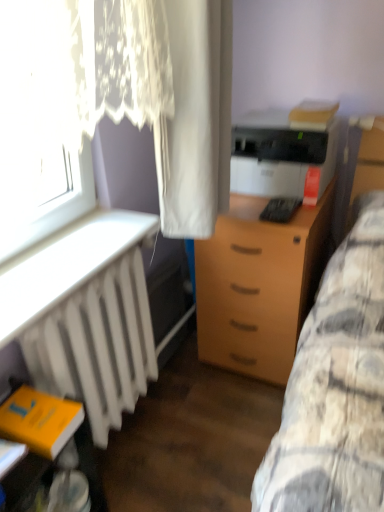
Question: Should I look upward or downward to see light brown wood drawer at center?

Choices:
 (A) down
 (B) up

Answer: (A)

Question: Is yellow matte book at lower left shorter than white sheer curtain at upper left, positioned as the second curtain in right-to-left order?

Choices:
 (A) yes
 (B) no

Answer: (A)

Question: Is yellow matte book at lower left not within white sheer curtain at upper left, positioned as the second curtain in right-to-left order?

Choices:
 (A) yes
 (B) no

Answer: (A)

Question: Is white sheer curtain at upper left, which appears as the 1th curtain when viewed from the left, at the back of yellow matte book at lower left?

Choices:
 (A) yes
 (B) no

Answer: (B)

Question: Considering the relative positions of yellow matte book at lower left and white sheer curtain at upper left, which appears as the 1th curtain when viewed from the left, in the image provided, is yellow matte book at lower left in front of white sheer curtain at upper left, which appears as the 1th curtain when viewed from the left,?

Choices:
 (A) no
 (B) yes

Answer: (B)

Question: Is white sheer curtain at upper left, positioned as the second curtain in right-to-left order, a part of yellow matte book at lower left?

Choices:
 (A) no
 (B) yes

Answer: (A)

Question: Is yellow matte book at lower left facing towards white sheer curtain at upper left, which appears as the 1th curtain when viewed from the left?

Choices:
 (A) no
 (B) yes

Answer: (A)

Question: Could you tell me if light brown wood drawer at center is facing white plastic radiator at left?

Choices:
 (A) yes
 (B) no

Answer: (B)

Question: Is light brown wood drawer at center at the left side of white plastic radiator at left?

Choices:
 (A) yes
 (B) no

Answer: (B)

Question: Can you confirm if light brown wood drawer at center is wider than white plastic radiator at left?

Choices:
 (A) yes
 (B) no

Answer: (A)

Question: Is light brown wood drawer at center turned away from white plastic radiator at left?

Choices:
 (A) yes
 (B) no

Answer: (B)

Question: From the image's perspective, is light brown wood drawer at center under white plastic radiator at left?

Choices:
 (A) yes
 (B) no

Answer: (A)

Question: Is light brown wood drawer at center to the right of white plastic radiator at left from the viewer's perspective?

Choices:
 (A) no
 (B) yes

Answer: (B)

Question: Is black plastic keyboard at center smaller than light brown wood drawer at center?

Choices:
 (A) yes
 (B) no

Answer: (A)